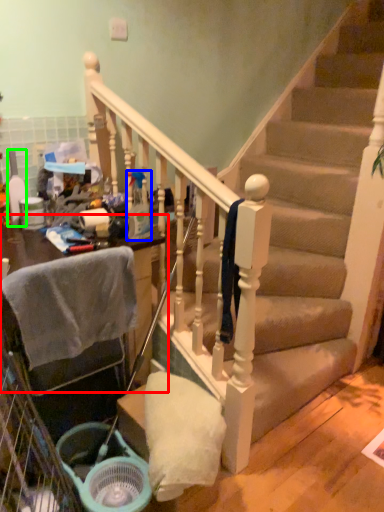
Question: Considering the real-world distances, which object is closest to furniture (highlighted by a red box)? bottle (highlighted by a blue box) or bottle (highlighted by a green box).

Choices:
 (A) bottle
 (B) bottle

Answer: (A)